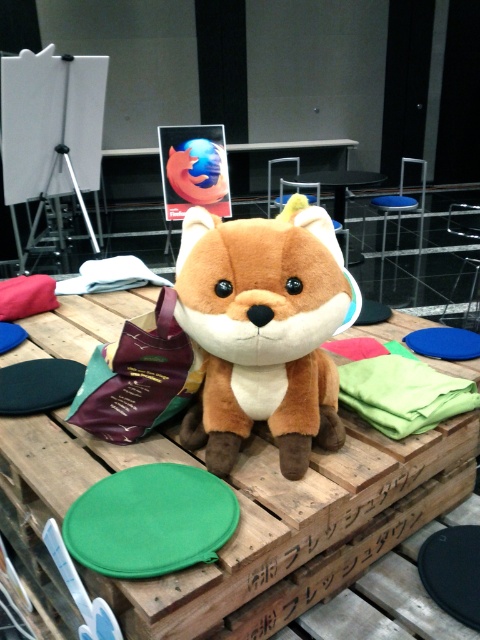
Question: Does soft plush toy at center have a greater width compared to soft fabric stuffed animal at center?

Choices:
 (A) no
 (B) yes

Answer: (A)

Question: Can you confirm if brown wooden table at center is positioned below soft plush toy at center?

Choices:
 (A) yes
 (B) no

Answer: (A)

Question: Which point appears farthest from the camera in this image?

Choices:
 (A) (357, 448)
 (B) (338, 184)

Answer: (B)

Question: Can you confirm if brown wooden table at center is positioned below soft fabric stuffed animal at center?

Choices:
 (A) no
 (B) yes

Answer: (B)

Question: Which point appears farthest from the camera in this image?

Choices:
 (A) (307, 605)
 (B) (336, 390)
 (C) (379, 180)

Answer: (C)

Question: Among these objects, which one is farthest from the camera?

Choices:
 (A) soft fabric stuffed animal at center
 (B) soft plush toy at center
 (C) brown wooden table at center

Answer: (A)